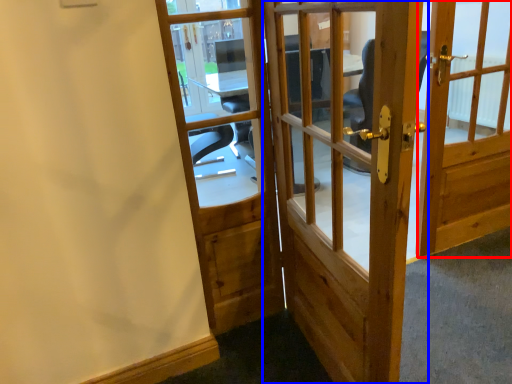
Question: Among these objects, which one is farthest to the camera, door (highlighted by a red box) or door (highlighted by a blue box)?

Choices:
 (A) door
 (B) door

Answer: (A)